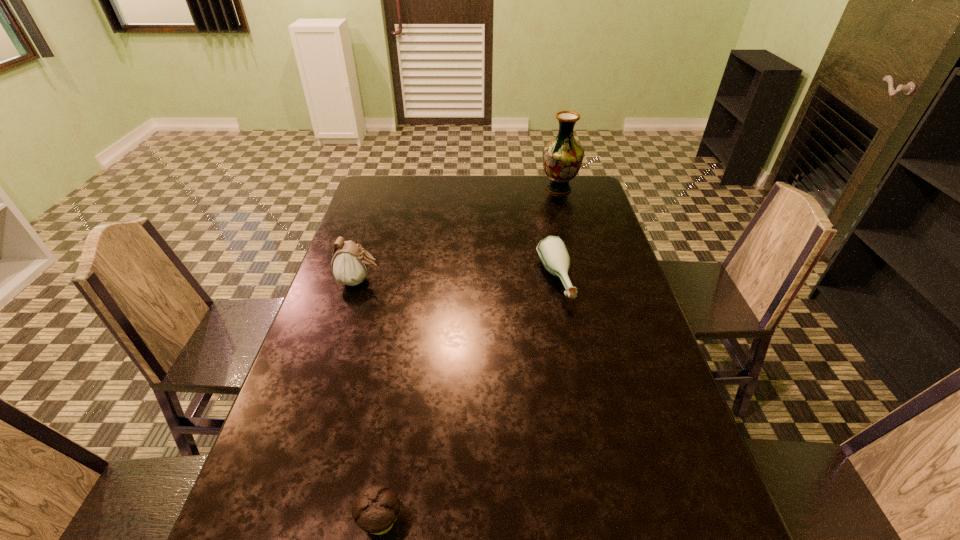
Where is `empty space between the bottle and the tallest object`? empty space between the bottle and the tallest object is located at coordinates (557, 234).

Locate an element on the screen. free space between the bottle and the vase is located at coordinates (557, 234).

At what (x,y) coordinates should I click in order to perform the action: click on vacant area between the pouch and the bottle. Please return your answer as a coordinate pair (x, y). This screenshot has height=540, width=960. Looking at the image, I should click on (457, 281).

I want to click on vacant area that lies between the bottle and the pouch, so click(457, 281).

Identify which object is the second closest to the farthest object. Please provide its 2D coordinates. Your answer should be formatted as a tuple, i.e. [(x, y)], where the tuple contains the x and y coordinates of a point satisfying the conditions above.

[(350, 263)]

The image size is (960, 540). Identify the location of object that is the second closest to the pouch. (375, 510).

Where is `vacant space that satisfies the following two spatial constraints: 1. on the back side of the bottle; 2. on the left side of the farthest object`? The height and width of the screenshot is (540, 960). vacant space that satisfies the following two spatial constraints: 1. on the back side of the bottle; 2. on the left side of the farthest object is located at coordinates (537, 188).